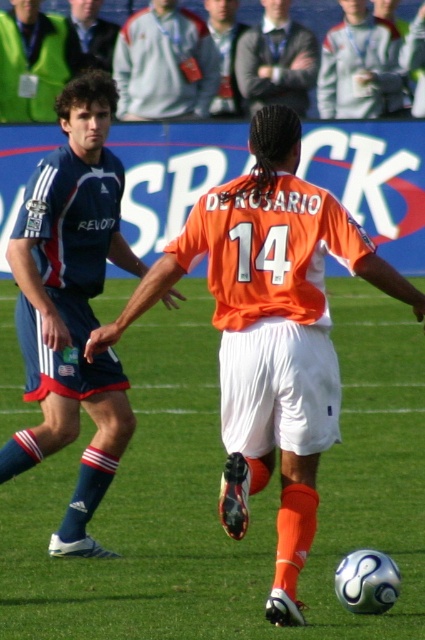
Question: Is the position of blue jersey at left more distant than that of gray fleece jacket at upper center?

Choices:
 (A) no
 (B) yes

Answer: (A)

Question: In this image, where is matte blue jersey at left located relative to smooth gray suit at upper center?

Choices:
 (A) above
 (B) below

Answer: (B)

Question: Which of the following is the farthest from the observer?

Choices:
 (A) orange jersey at center
 (B) blue jersey at left
 (C) dark gray jacket at upper center
 (D) gray fleece jacket at upper center

Answer: (C)

Question: Which is nearer to the green matte vest at upper left?

Choices:
 (A) green grass at center
 (B) matte blue jersey at left
 (C) orange jersey at center

Answer: (B)

Question: Which point is closer to the camera taking this photo?

Choices:
 (A) (367, 115)
 (B) (54, 378)
 (C) (224, 77)
 (D) (65, 612)

Answer: (D)

Question: Is blue fabric shorts at left positioned behind green matte vest at upper left?

Choices:
 (A) yes
 (B) no

Answer: (B)